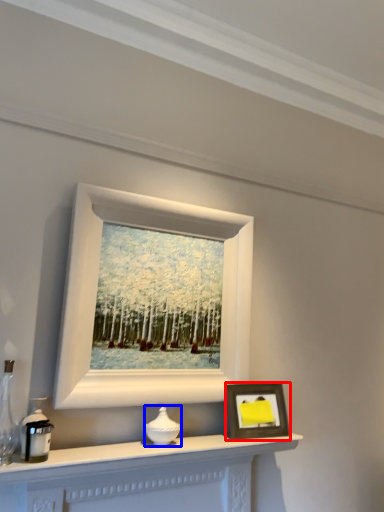
Question: Which point is further to the camera, picture frame (highlighted by a red box) or candle holder (highlighted by a blue box)?

Choices:
 (A) picture frame
 (B) candle holder

Answer: (A)